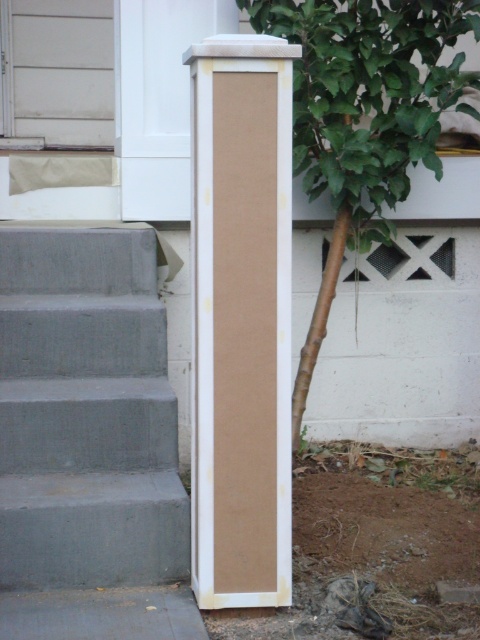
In the scene shown: Who is positioned more to the right, gray concrete stairs at lower left or green leafy tree at center?

From the viewer's perspective, green leafy tree at center appears more on the right side.

Measure the distance between point (56, 380) and camera.

Point (56, 380) is 6.34 meters from camera.

This screenshot has height=640, width=480. What are the coordinates of `gray concrete stairs at lower left` in the screenshot? It's located at (85, 413).

Is the position of matte cardboard pillar at center less distant than that of green leafy tree at center?

Yes, it is in front of green leafy tree at center.

Image resolution: width=480 pixels, height=640 pixels. What do you see at coordinates (241, 320) in the screenshot? I see `matte cardboard pillar at center` at bounding box center [241, 320].

Is point (231, 225) farther from viewer compared to point (287, 6)?

No, (231, 225) is closer to viewer.

Where is `matte cardboard pillar at center`? matte cardboard pillar at center is located at coordinates (241, 320).

Is gray concrete stairs at lower left behind matte cardboard pillar at center?

Yes.

Between gray concrete stairs at lower left and matte cardboard pillar at center, which one has more height?

matte cardboard pillar at center

The image size is (480, 640). What are the coordinates of `gray concrete stairs at lower left` in the screenshot? It's located at (x=85, y=413).